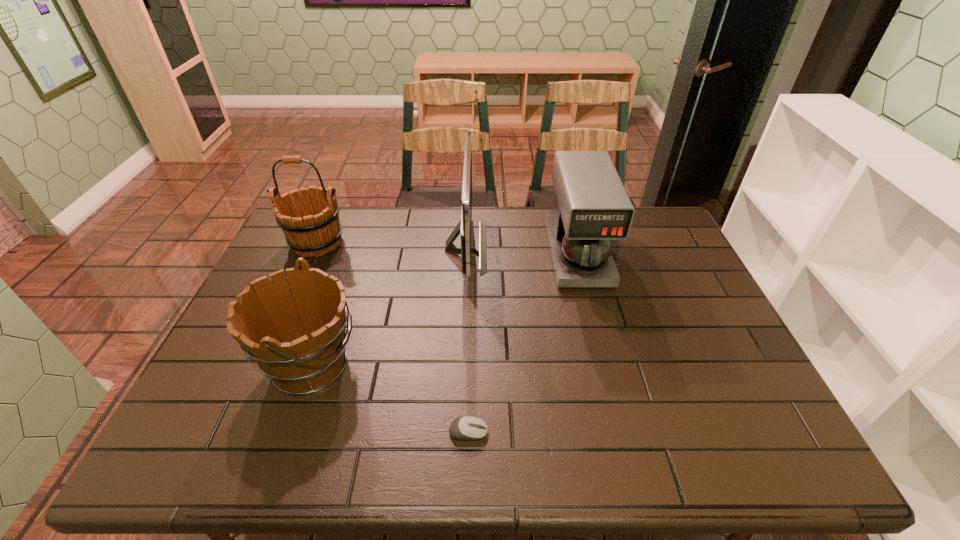
Locate an element on the screen. This screenshot has height=540, width=960. free spot located with the handle on the shorter wine bucket is located at coordinates (461, 366).

Identify the location of vacant space situated 0.070m on the wheel side of the nearest object. (519, 432).

The height and width of the screenshot is (540, 960). I want to click on wine bucket present at the far edge, so click(x=318, y=231).

Locate an element on the screen. This screenshot has height=540, width=960. monitor that is at the far edge is located at coordinates (465, 245).

This screenshot has height=540, width=960. Identify the location of coffee maker that is at the far edge. (591, 207).

The image size is (960, 540). I want to click on object located in the near edge section of the desktop, so click(468, 428).

Locate an element on the screen. This screenshot has width=960, height=540. object that is at the far left corner is located at coordinates (318, 231).

In the image, there is a desktop. Identify the location of vacant space at the far edge. This screenshot has height=540, width=960. (540, 219).

I want to click on free space at the near edge of the desktop, so click(x=495, y=433).

Where is `vacant area at the left edge of the desktop`? vacant area at the left edge of the desktop is located at coordinates (230, 381).